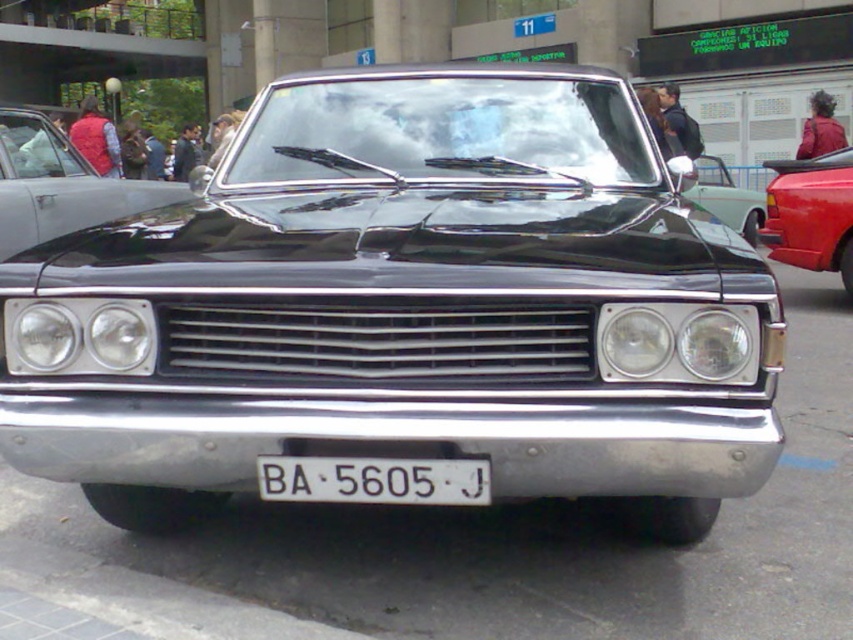
Question: Considering the relative positions of glossy black car at left and shiny chrome mirror at center in the image provided, where is glossy black car at left located with respect to shiny chrome mirror at center?

Choices:
 (A) left
 (B) right

Answer: (A)

Question: Which object is positioned closest to the clear glass windshield at center?

Choices:
 (A) shiny red car at right
 (B) white plastic license plate at center
 (C) shiny chrome mirror at center
 (D) glossy black car at left

Answer: (B)

Question: Which object appears closest to the camera in this image?

Choices:
 (A) clear glass windshield at center
 (B) white plastic license plate at center

Answer: (B)

Question: Can you confirm if clear glass windshield at center is thinner than white plastic license plate at center?

Choices:
 (A) no
 (B) yes

Answer: (A)

Question: Which object is positioned closest to the glossy black car at left?

Choices:
 (A) clear glass windshield at center
 (B) shiny red car at right
 (C) shiny chrome mirror at center

Answer: (A)

Question: Does clear glass windshield at center appear under glossy black car at left?

Choices:
 (A) no
 (B) yes

Answer: (B)